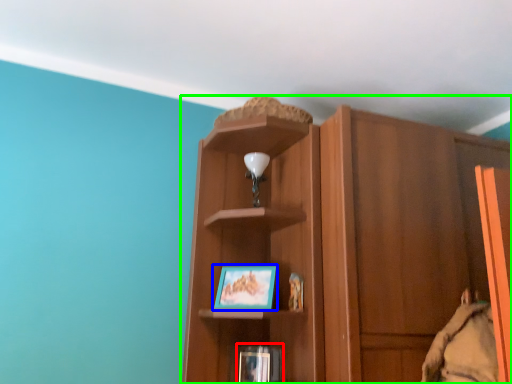
Question: Considering the real-world distances, which object is closest to book (highlighted by a red box)? picture frame (highlighted by a blue box) or cupboard (highlighted by a green box).

Choices:
 (A) picture frame
 (B) cupboard

Answer: (A)